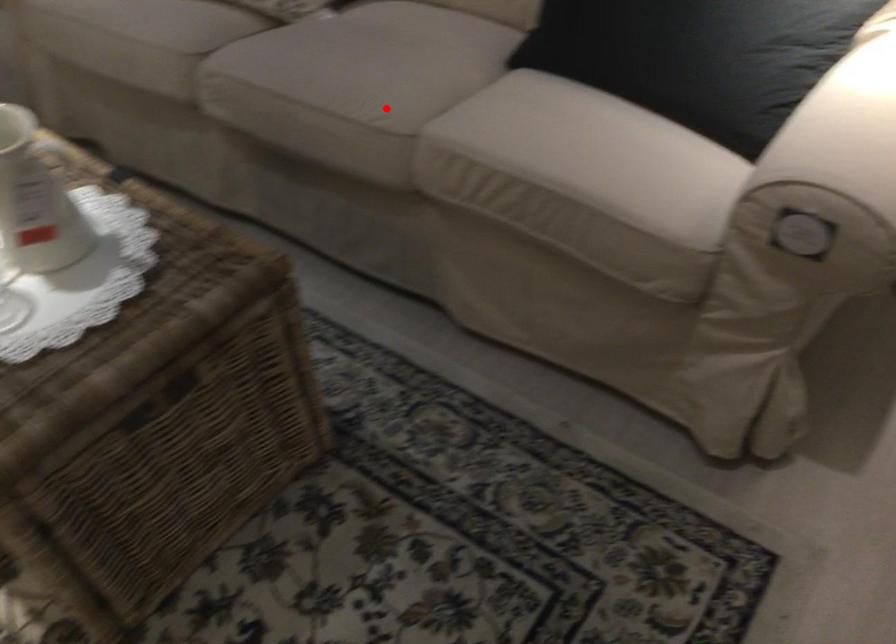
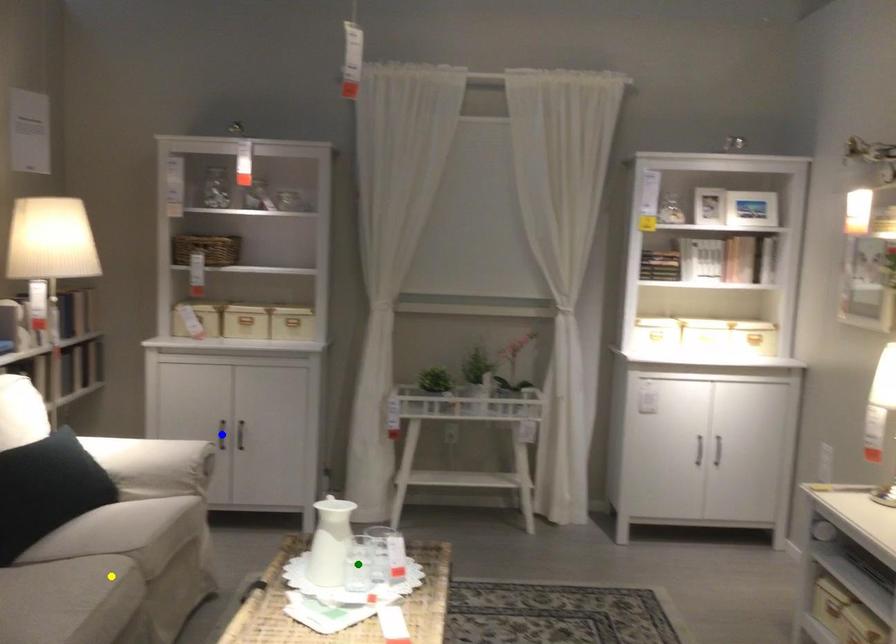
Question: I am providing you with two images of the same scene from different viewpoints. A red point is marked on the first image. You are given multiple points on the second image. Can you choose the point in image 2 that corresponds to the point in image 1?

Choices:
 (A) green point
 (B) blue point
 (C) yellow point

Answer: (C)